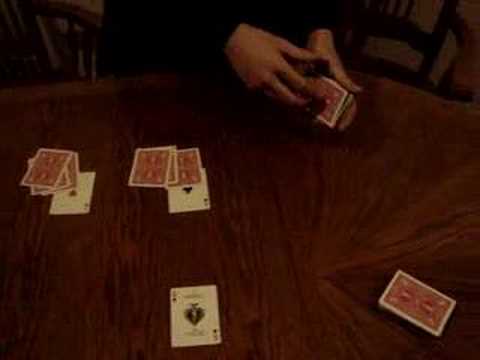
At what (x,y) coordinates should I click in order to perform the action: click on table. Please return your answer as a coordinate pair (x, y). The height and width of the screenshot is (360, 480). Looking at the image, I should click on (274, 250).